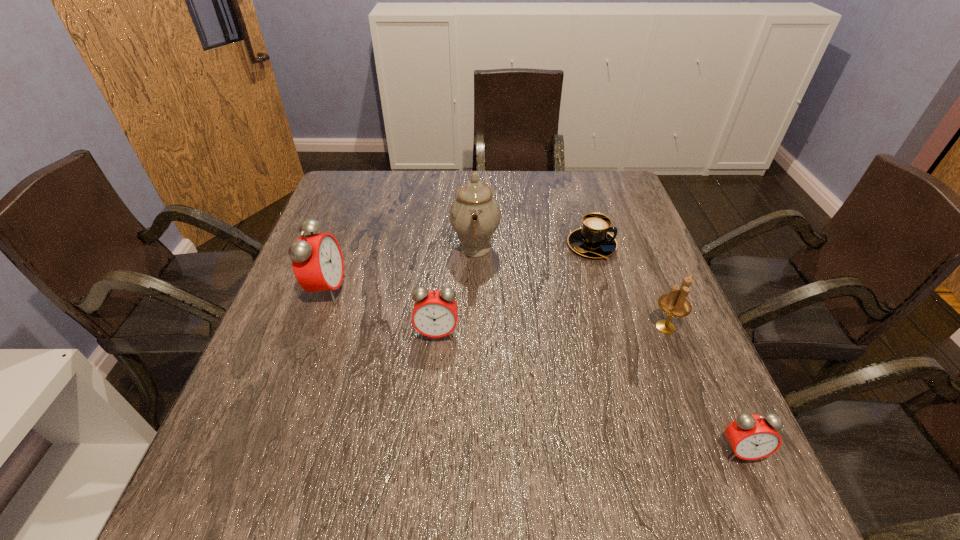
This screenshot has width=960, height=540. I want to click on alarm clock that can be found as the second closest to the leftmost alarm clock, so tap(751, 437).

Locate an element on the screen. This screenshot has height=540, width=960. vacant space that satisfies the following two spatial constraints: 1. on the back side of the candle holder; 2. on the spout of the chinaware is located at coordinates (634, 247).

This screenshot has width=960, height=540. I want to click on vacant space that satisfies the following two spatial constraints: 1. on the spout of the chinaware; 2. on the front-facing side of the second farthest alarm clock, so click(474, 333).